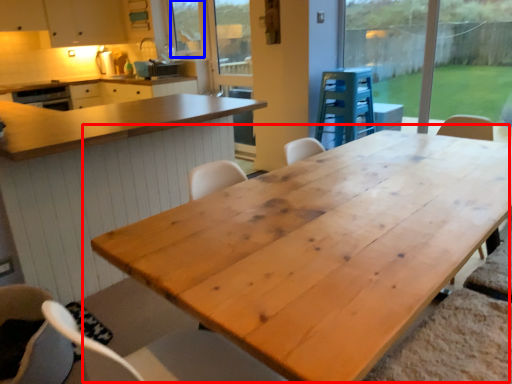
Question: Which point is further to the camera, table (highlighted by a red box) or window screen (highlighted by a blue box)?

Choices:
 (A) table
 (B) window screen

Answer: (B)